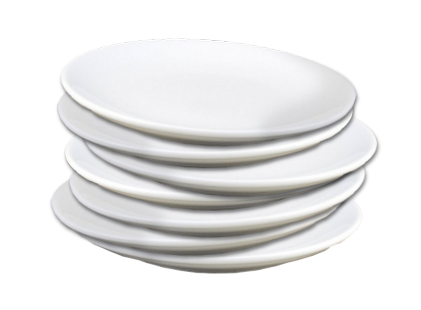
The image size is (421, 310). Find the location of `plates`. plates is located at coordinates (265, 261), (182, 240), (233, 223), (183, 198), (265, 185), (186, 158), (234, 130).